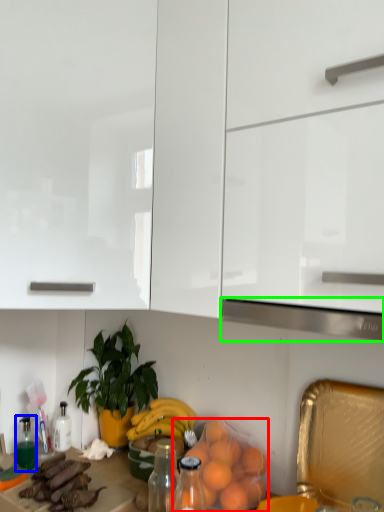
Question: Which object is the farthest from orange (highlighted by a red box)? Choose among these: bottle (highlighted by a blue box) or exhaust hood (highlighted by a green box).

Choices:
 (A) bottle
 (B) exhaust hood

Answer: (A)